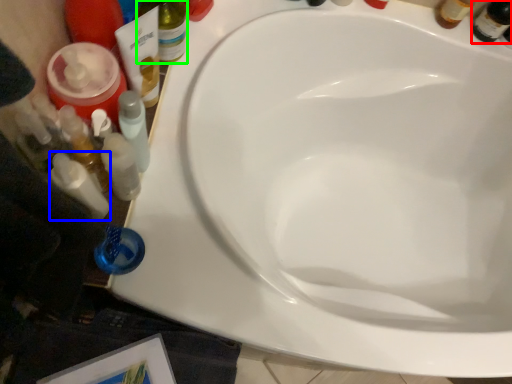
Question: Based on their relative distances, which object is farther from beer bottle (highlighted by a red box)? Choose from toiletry (highlighted by a blue box) and bottle (highlighted by a green box).

Choices:
 (A) toiletry
 (B) bottle

Answer: (A)